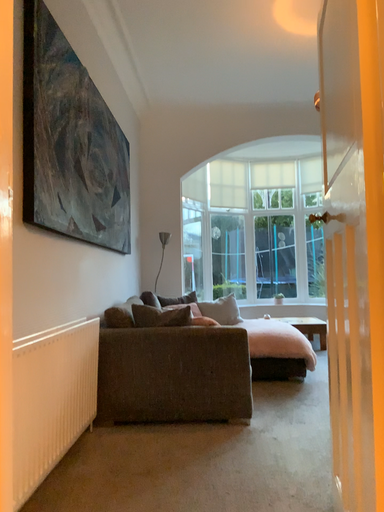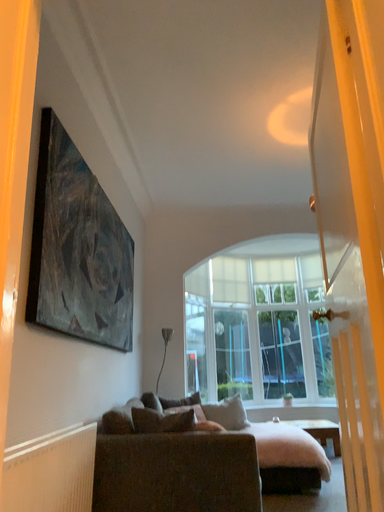
Question: Which way did the camera rotate in the video?

Choices:
 (A) rotated downward
 (B) rotated upward

Answer: (B)